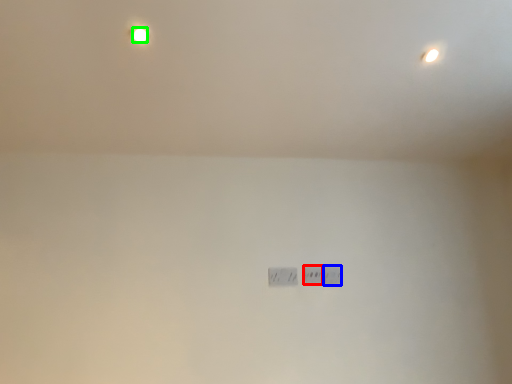
Question: Which object is positioned farthest from power plugs and sockets (highlighted by a red box)? Select from power plugs and sockets (highlighted by a blue box) and light bulb (highlighted by a green box).

Choices:
 (A) power plugs and sockets
 (B) light bulb

Answer: (B)